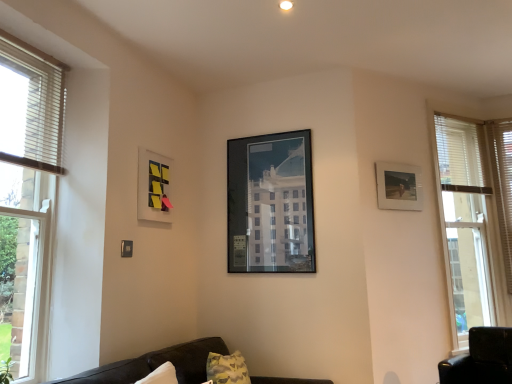
Question: Considering the relative sizes of dark brown leather couch at lower center and matte plastic picture frame at upper left, which appears as the 3th picture frame when viewed from the right, in the image provided, is dark brown leather couch at lower center shorter than matte plastic picture frame at upper left, which appears as the 3th picture frame when viewed from the right,?

Choices:
 (A) no
 (B) yes

Answer: (B)

Question: From the image's perspective, is dark brown leather couch at lower center on top of matte plastic picture frame at upper left, which appears as the 3th picture frame when viewed from the right?

Choices:
 (A) yes
 (B) no

Answer: (B)

Question: From a real-world perspective, is dark brown leather couch at lower center located beneath matte plastic picture frame at upper left, acting as the first picture frame starting from the left?

Choices:
 (A) no
 (B) yes

Answer: (B)

Question: Is there a large distance between dark brown leather couch at lower center and matte plastic picture frame at upper left, acting as the first picture frame starting from the left?

Choices:
 (A) yes
 (B) no

Answer: (B)

Question: Can you confirm if dark brown leather couch at lower center is thinner than matte plastic picture frame at upper left, acting as the first picture frame starting from the left?

Choices:
 (A) no
 (B) yes

Answer: (A)

Question: Based on their positions, is clear glass window at left located to the left or right of matte plastic picture frame at upper left, acting as the first picture frame starting from the left?

Choices:
 (A) right
 (B) left

Answer: (B)

Question: From the image's perspective, is clear glass window at left above or below matte plastic picture frame at upper left, which appears as the 3th picture frame when viewed from the right?

Choices:
 (A) above
 (B) below

Answer: (B)

Question: From a real-world perspective, is clear glass window at left physically located above or below matte plastic picture frame at upper left, acting as the first picture frame starting from the left?

Choices:
 (A) below
 (B) above

Answer: (A)

Question: Considering their positions, is clear glass window at left located in front of or behind matte plastic picture frame at upper left, acting as the first picture frame starting from the left?

Choices:
 (A) behind
 (B) front

Answer: (B)

Question: Is matte glass picture frame at center, which is the 2th picture frame in right-to-left order, taller or shorter than white textured blind at right, acting as the 1th blind starting from the back?

Choices:
 (A) tall
 (B) short

Answer: (B)

Question: From a real-world perspective, is matte glass picture frame at center, which is the 2th picture frame in right-to-left order, positioned above or below white textured blind at right, which appears as the first blind when viewed from the right?

Choices:
 (A) above
 (B) below

Answer: (A)

Question: Is matte glass picture frame at center, the second picture frame from the left, wider or thinner than white textured blind at right, which ranks as the second blind in left-to-right order?

Choices:
 (A) wide
 (B) thin

Answer: (B)

Question: Is matte glass picture frame at center, which is the 2th picture frame in right-to-left order, bigger or smaller than white textured blind at right, which appears as the first blind when viewed from the right?

Choices:
 (A) small
 (B) big

Answer: (A)

Question: Looking at their shapes, would you say clear glass window at left is wider or thinner than white textured blind at right, which appears as the first blind when viewed from the right?

Choices:
 (A) thin
 (B) wide

Answer: (B)

Question: Is clear glass window at left situated inside white textured blind at right, which appears as the first blind when viewed from the right, or outside?

Choices:
 (A) outside
 (B) inside

Answer: (A)